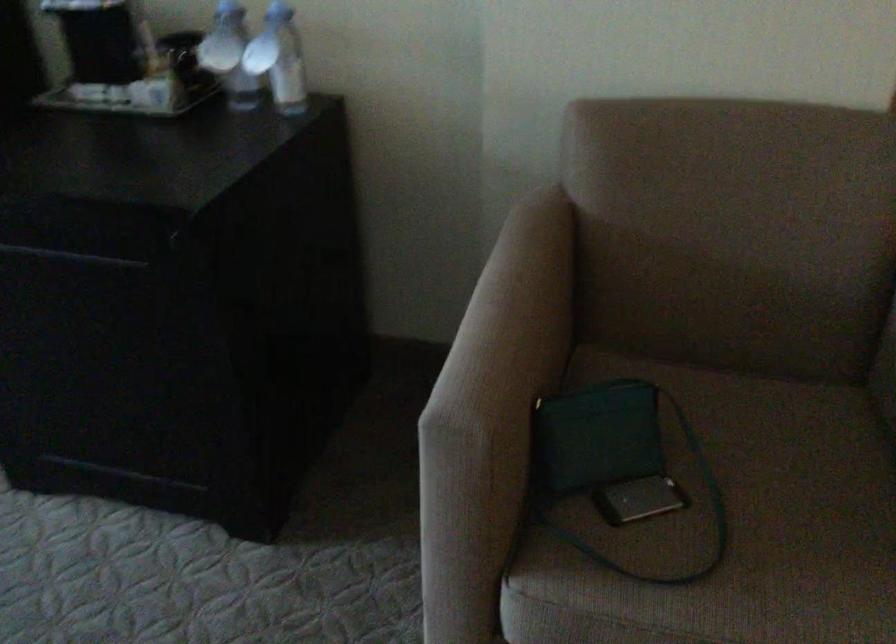
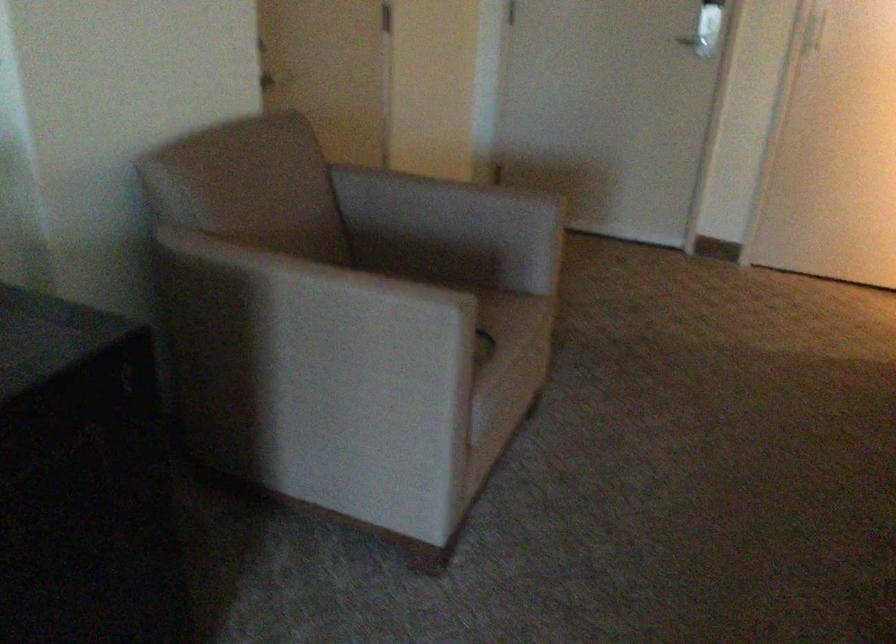
In the second image, find the point that corresponds to point 495,390 in the first image.

(435, 289)